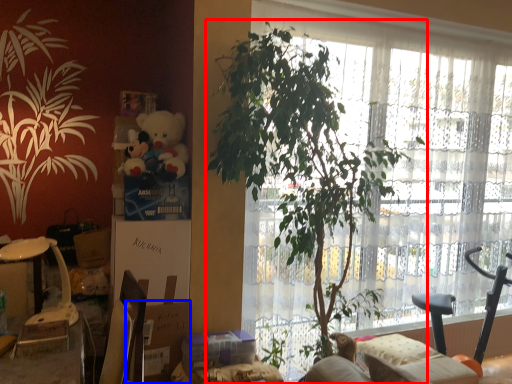
Question: Which object appears farthest to the camera in this image, houseplant (highlighted by a red box) or cardboard box (highlighted by a blue box)?

Choices:
 (A) houseplant
 (B) cardboard box

Answer: (B)